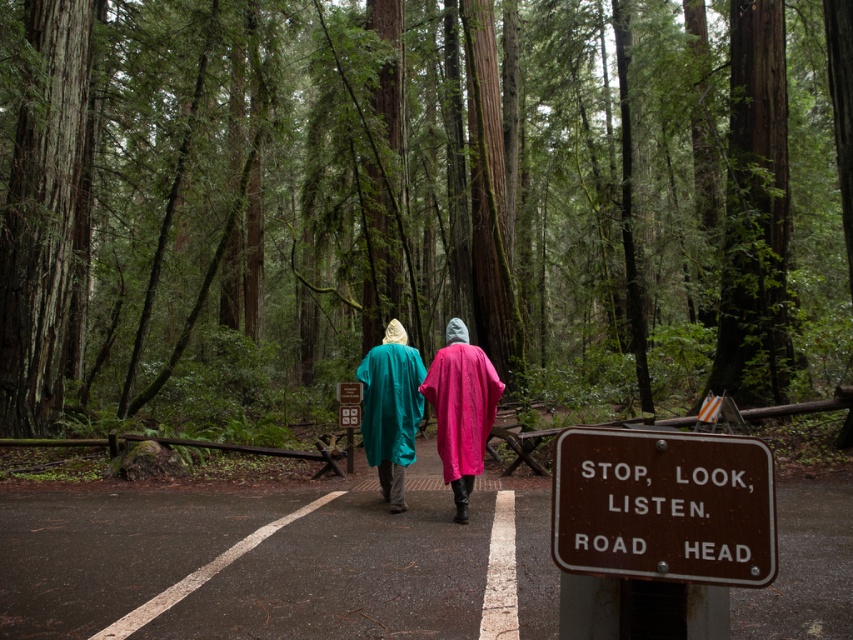
Is green matte rain poncho at center thinner than teal matte poncho at center?

No.

Who is positioned more to the left, green matte rain poncho at center or teal matte poncho at center?

teal matte poncho at center

The width and height of the screenshot is (853, 640). I want to click on green matte rain poncho at center, so click(x=418, y=198).

Find the location of a particular element. green matte rain poncho at center is located at coordinates 418,198.

Which is more to the right, green matte rain poncho at center or pink fabric robe at center?

green matte rain poncho at center is more to the right.

Can you confirm if green matte rain poncho at center is shorter than pink fabric robe at center?

No, green matte rain poncho at center is not shorter than pink fabric robe at center.

Which is behind, point (225, 333) or point (500, 394)?

The point (225, 333) is behind.

I want to click on green matte rain poncho at center, so click(x=418, y=198).

Can you confirm if teal matte poncho at center is positioned above matte teal robe at center?

Incorrect, teal matte poncho at center is not positioned above matte teal robe at center.

Between teal matte poncho at center and matte teal robe at center, which one is positioned lower?

teal matte poncho at center is below.

What do you see at coordinates (461, 410) in the screenshot? The image size is (853, 640). I see `teal matte poncho at center` at bounding box center [461, 410].

This screenshot has height=640, width=853. I want to click on teal matte poncho at center, so click(x=461, y=410).